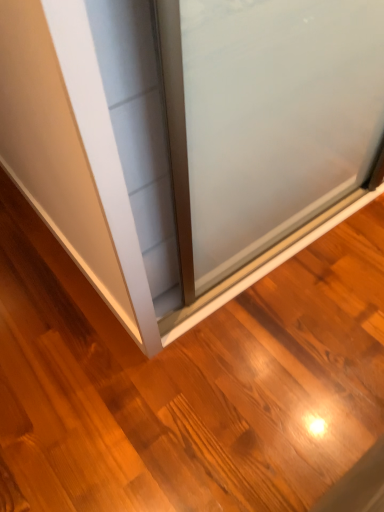
The width and height of the screenshot is (384, 512). I want to click on matte glass door at center, so click(189, 138).

What do you see at coordinates (189, 138) in the screenshot? I see `matte glass door at center` at bounding box center [189, 138].

Find the location of a particular element. Image resolution: width=384 pixels, height=512 pixels. matte glass door at center is located at coordinates (189, 138).